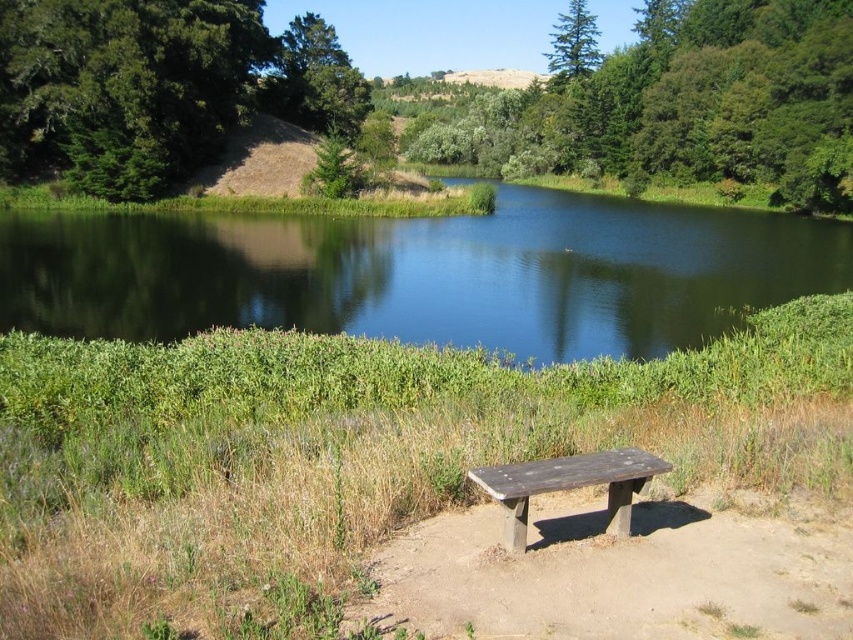
You are a bird looking for a higher perch. You see the green leafy tree at upper center and the green matte tree at upper center. Which tree should you choose to reach a higher position?

The green leafy tree at upper center is taller than the green matte tree at upper center, so you should choose the green leafy tree at upper center to reach a higher position.

You are planning to place a picnic blanket on the wooden bench at center. Can the picnic blanket fit on the bench if the blanket is as wide as the green leafy tree at upper center?

The green leafy tree at upper center might be wider than wooden bench at center, so the picnic blanket might not fit on the bench if it matches the tree width.